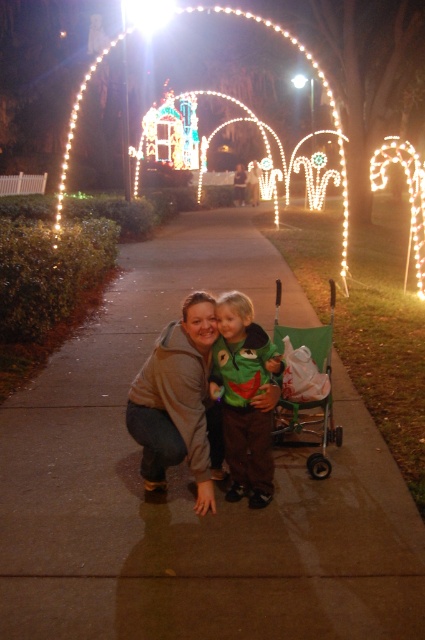
From the picture: You are a photographer trying to capture the festive atmosphere. You notice the green fuzzy sweater at center and the illuminated wireframe arch at center. Which object is wider?

The green fuzzy sweater at center is narrower than the illuminated wireframe arch at center, so the illuminated wireframe arch at center is wider.

You are standing on the brown concrete sidewalk at center and want to place the brown soft jacket at center on it. Given that the sidewalk is larger, will the jacket fit comfortably without overlapping the edges?

The brown concrete sidewalk at center has a larger size compared to the brown soft jacket at center, so the jacket will fit comfortably without overlapping the edges.

You are standing at the camera position and want to place a small decoration exactly 3.66 meters away. Can you use the point marked at coordinate point (172,401) to determine where to place it?

Yes, the point marked at coordinate point (172,401) is exactly 3.66 meters from the camera, so placing the decoration there would meet the requirement.